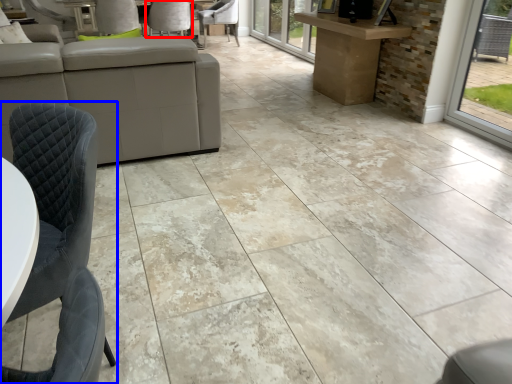
Question: Which object appears closest to the camera in this image, chair (highlighted by a red box) or chair (highlighted by a blue box)?

Choices:
 (A) chair
 (B) chair

Answer: (B)